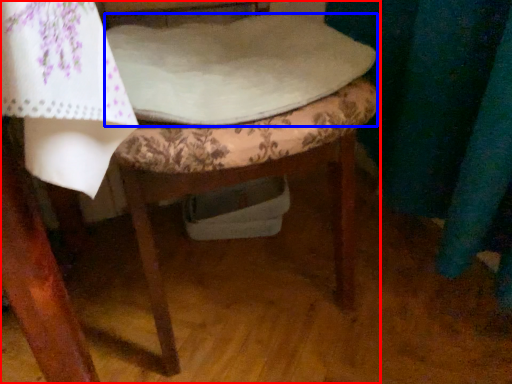
Question: Which of the following is the closest to the observer, chair (highlighted by a red box) or sheet (highlighted by a blue box)?

Choices:
 (A) chair
 (B) sheet

Answer: (A)